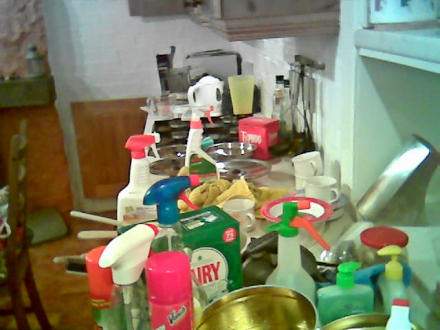
Locate an element on the screen. The height and width of the screenshot is (330, 440). curtain is located at coordinates (19, 30).